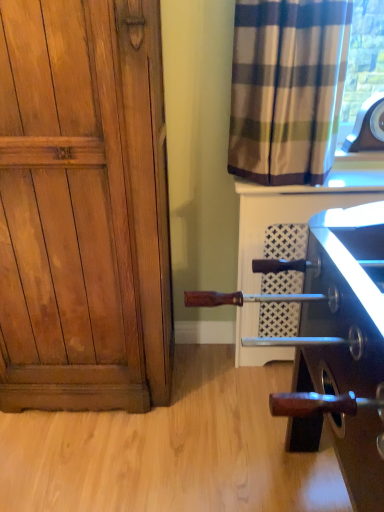
Where is `free space in front of wooden paneling at left`? free space in front of wooden paneling at left is located at coordinates (88, 455).